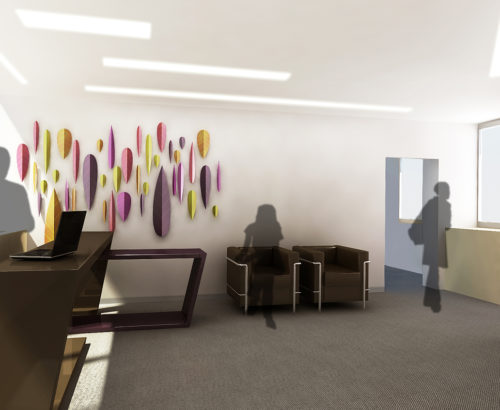
Where is `ceiling`? ceiling is located at coordinates (374, 48).